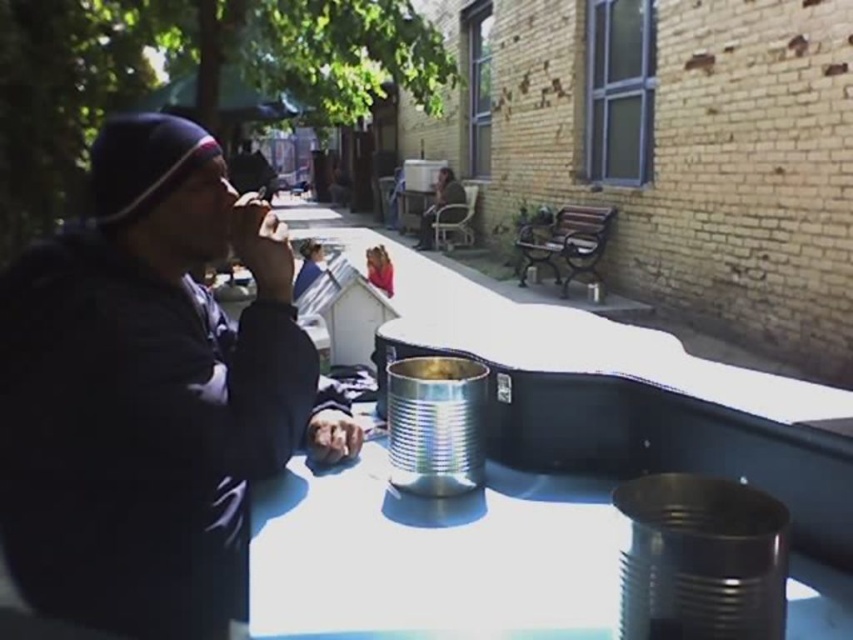
You are a fashion designer observing two jackets in an urban setting. The matte black jacket at left and the dark brown leather jacket at center are both on display. Which jacket appears taller when viewed from your current angle?

The dark brown leather jacket at center appears taller than the matte black jacket at left.